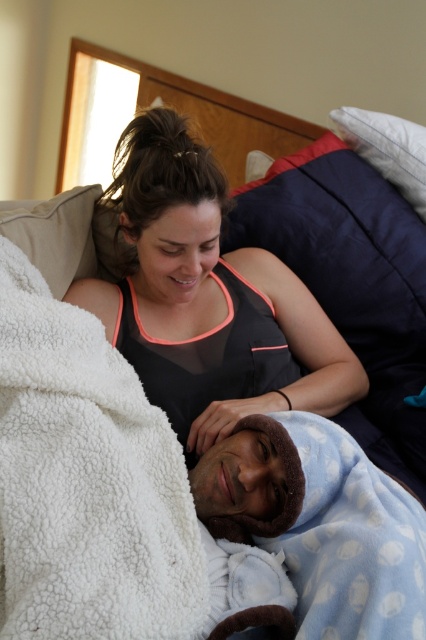
Is black mesh tank top at center taller than dark blue fabric pillow at upper right?

Indeed, black mesh tank top at center has a greater height compared to dark blue fabric pillow at upper right.

The height and width of the screenshot is (640, 426). What do you see at coordinates (207, 298) in the screenshot? I see `black mesh tank top at center` at bounding box center [207, 298].

Does point (270, 328) come behind point (344, 136)?

No, (270, 328) is in front of (344, 136).

Locate an element on the screen. black mesh tank top at center is located at coordinates point(207,298).

Who is higher up, navy blue pillow at upper right or beige soft pillow at upper left?

beige soft pillow at upper left

You are a GUI agent. You are given a task and a screenshot of the screen. Output one action in this format:
    pyautogui.click(x=<x>, y=<y>)
    Task: Click on the navy blue pillow at upper right
    This screenshot has height=640, width=426.
    Given the screenshot: What is the action you would take?
    pyautogui.click(x=348, y=259)

Does point (311, 227) come closer to viewer compared to point (80, 200)?

No, it is not.

Image resolution: width=426 pixels, height=640 pixels. What are the coordinates of `navy blue pillow at upper right` in the screenshot? It's located at (348, 259).

Is white fluffy blanket at upper left below beige soft pillow at upper left?

Indeed, white fluffy blanket at upper left is positioned under beige soft pillow at upper left.

The width and height of the screenshot is (426, 640). I want to click on white fluffy blanket at upper left, so tap(86, 483).